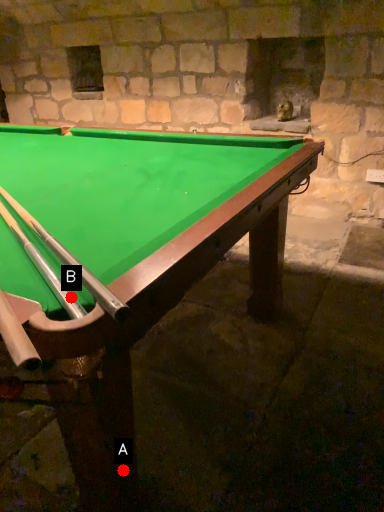
Question: Two points are circled on the image, labeled by A and B beside each circle. Which of the following is the closest to the observer?

Choices:
 (A) A is closer
 (B) B is closer

Answer: (B)